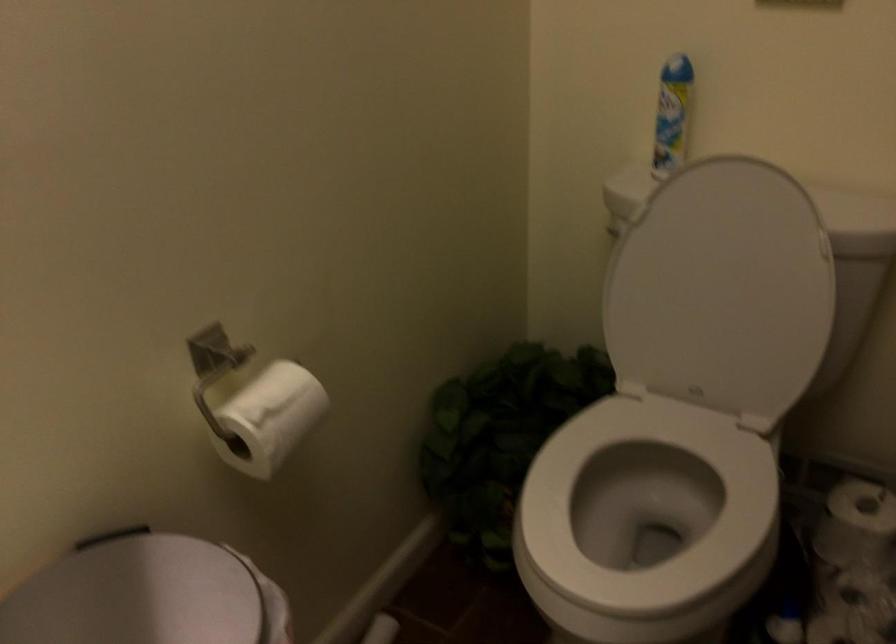
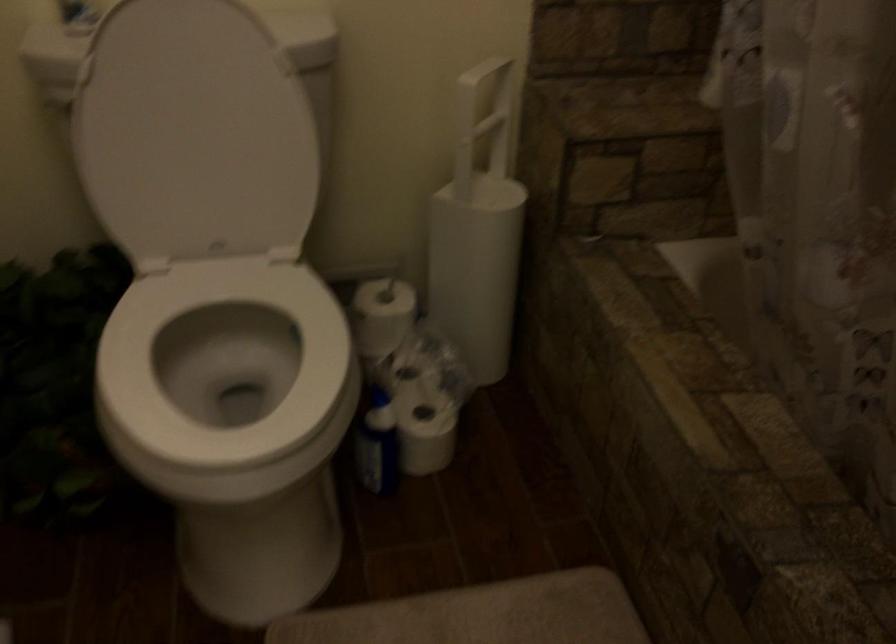
Find the pixel in the second image that matches the point at 651,500 in the first image.

(224, 365)